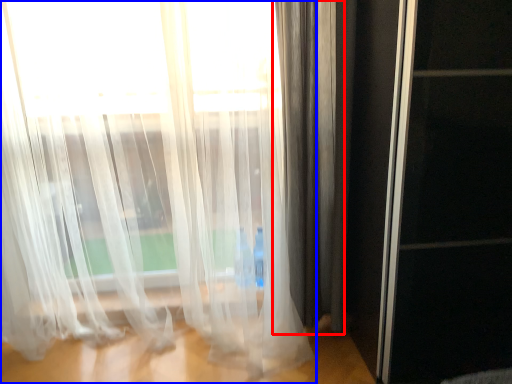
Question: Which object appears farthest to the camera in this image, curtain (highlighted by a red box) or curtain (highlighted by a blue box)?

Choices:
 (A) curtain
 (B) curtain

Answer: (A)